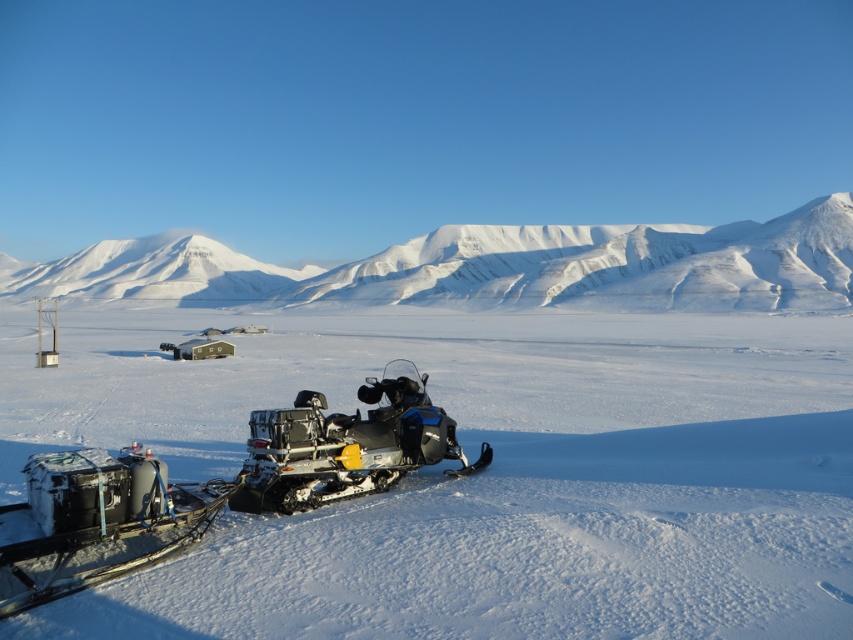
Question: In this image, where is white powdery snow at center located relative to silver metallic snowmobile at center?

Choices:
 (A) above
 (B) below

Answer: (A)

Question: Does white snow-covered mountain at upper center appear under metallic blue snowmobile at center?

Choices:
 (A) no
 (B) yes

Answer: (A)

Question: Is white snow-covered mountain at upper center thinner than silver metallic snowmobile at center?

Choices:
 (A) yes
 (B) no

Answer: (B)

Question: Among these objects, which one is farthest from the camera?

Choices:
 (A) silver metallic snowmobile at center
 (B) white powdery snow at center
 (C) metallic blue snowmobile at center
 (D) white snow-covered mountain at upper center

Answer: (D)

Question: Which point is farther from the camera taking this photo?

Choices:
 (A) (358, 429)
 (B) (668, 342)

Answer: (B)

Question: Which point appears farthest from the camera in this image?

Choices:
 (A) (524, 586)
 (B) (310, 456)
 (C) (276, 422)

Answer: (B)